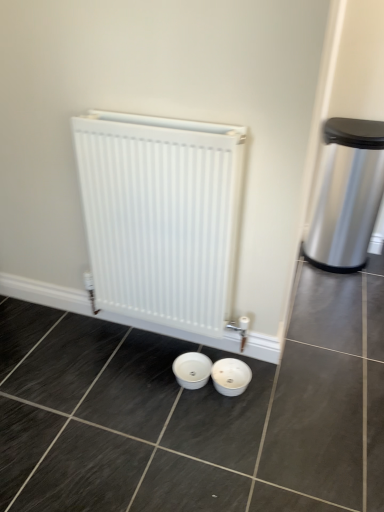
Locate an element on the screen. The image size is (384, 512). vacant space that is to the left of white glossy basin at center is located at coordinates click(x=179, y=391).